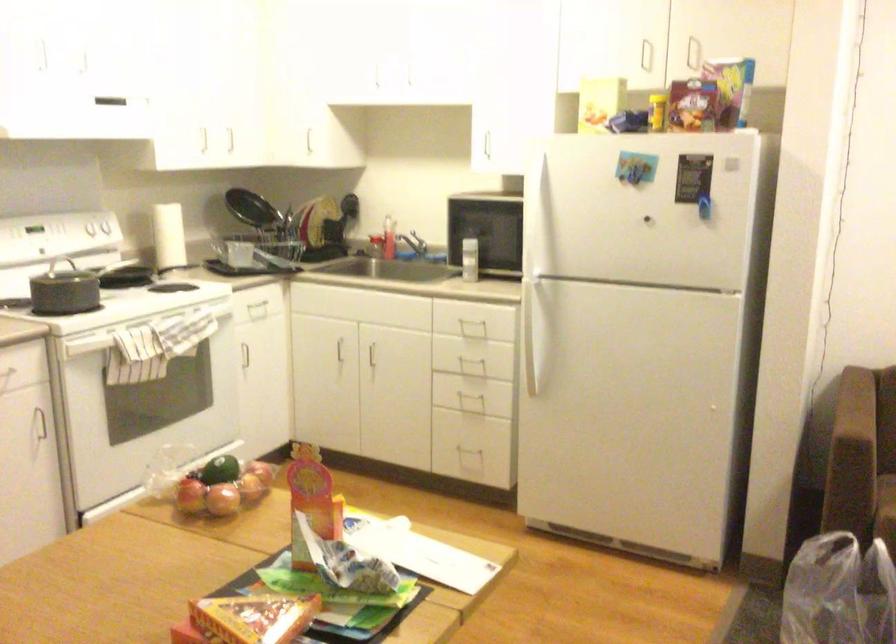
This screenshot has width=896, height=644. What do you see at coordinates (536, 328) in the screenshot? I see `a freezer handle` at bounding box center [536, 328].